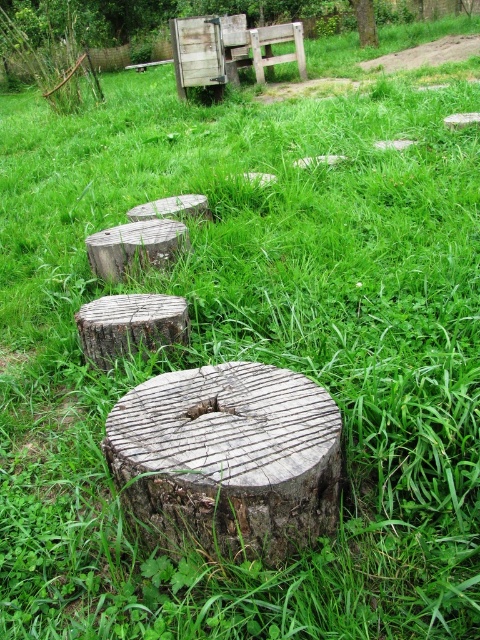
Is point (284, 435) positioned after point (360, 20)?

No, it is in front of (360, 20).

Which of these two, rough textured wood stump at center or smooth brown tree trunk at upper center, stands shorter?

rough textured wood stump at center is shorter.

Locate an element on the screen. rough textured wood stump at center is located at coordinates (228, 458).

Can you confirm if rough bark stump at center is smaller than rough wooden stump at center?

Yes, rough bark stump at center is smaller than rough wooden stump at center.

Is point (141, 308) farther from camera compared to point (106, 273)?

That is False.

I want to click on rough bark stump at center, so (x=130, y=324).

Which is more to the left, rough textured wood stump at center or rough bark stump at center?

rough bark stump at center is more to the left.

Can you confirm if rough textured wood stump at center is thinner than rough bark stump at center?

In fact, rough textured wood stump at center might be wider than rough bark stump at center.

The image size is (480, 640). What do you see at coordinates (228, 458) in the screenshot?
I see `rough textured wood stump at center` at bounding box center [228, 458].

In order to click on rough textured wood stump at center in this screenshot , I will do `click(228, 458)`.